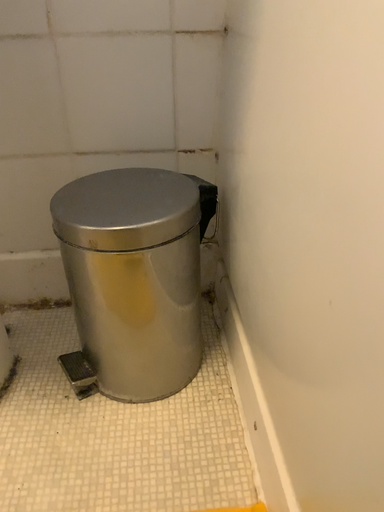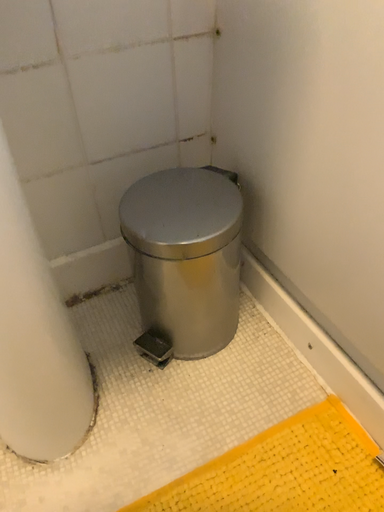
Question: Which way did the camera rotate in the video?

Choices:
 (A) rotated upward
 (B) rotated downward

Answer: (B)